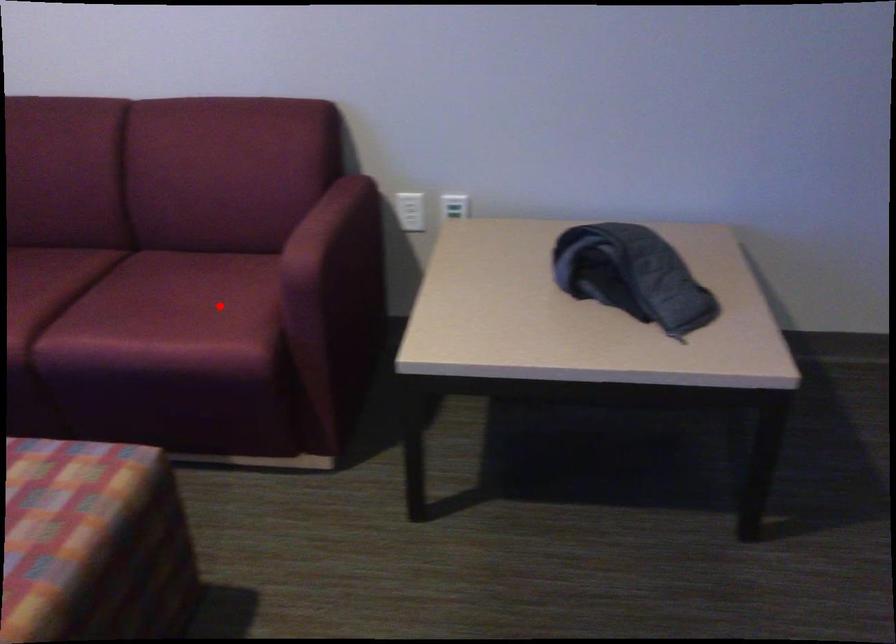
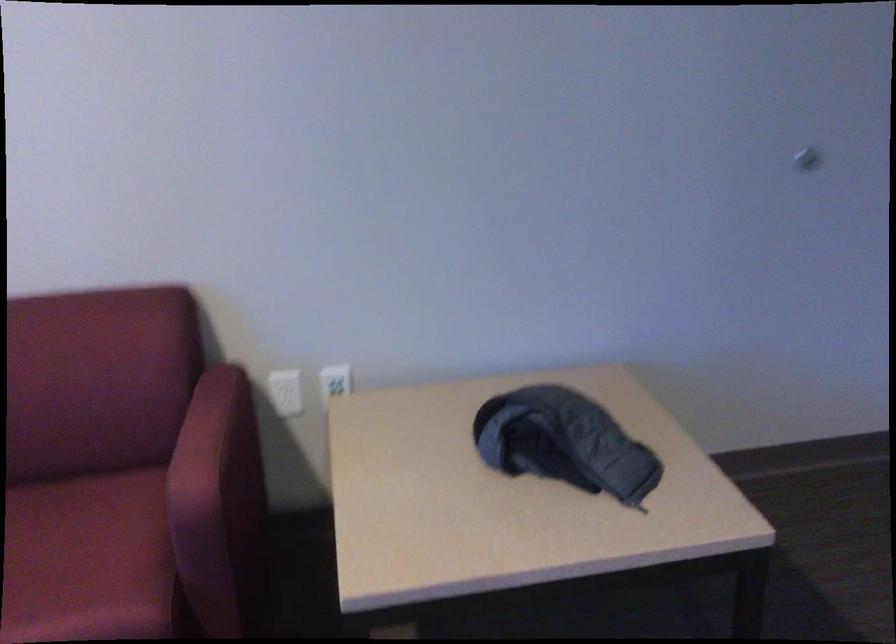
In the second image, find the point that corresponds to the highlighted location in the first image.

(88, 560)